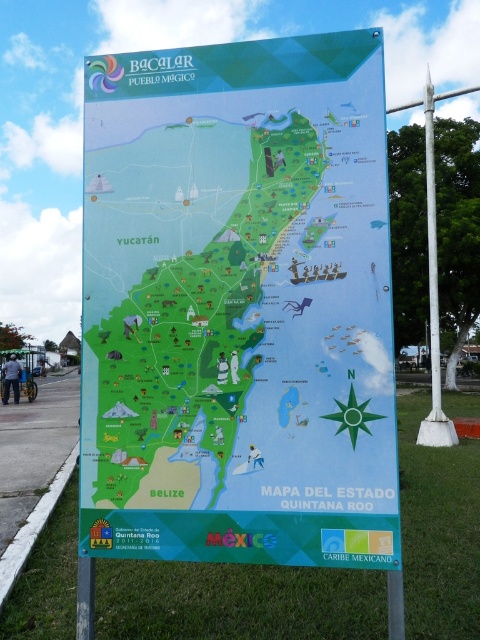
Question: Which object appears farthest from the camera in this image?

Choices:
 (A) white metallic pole at right
 (B) green paper map at center

Answer: (A)

Question: Can you confirm if green paper map at center is positioned below white metallic pole at right?

Choices:
 (A) yes
 (B) no

Answer: (A)

Question: Is green paper map at center wider than white metallic pole at right?

Choices:
 (A) yes
 (B) no

Answer: (B)

Question: Which of the following is the farthest from the observer?

Choices:
 (A) (180, 140)
 (B) (411, 104)

Answer: (B)

Question: Is the position of green paper map at center less distant than that of white metallic pole at right?

Choices:
 (A) no
 (B) yes

Answer: (B)

Question: Which point is closer to the camera?

Choices:
 (A) (188, 152)
 (B) (432, 388)

Answer: (A)